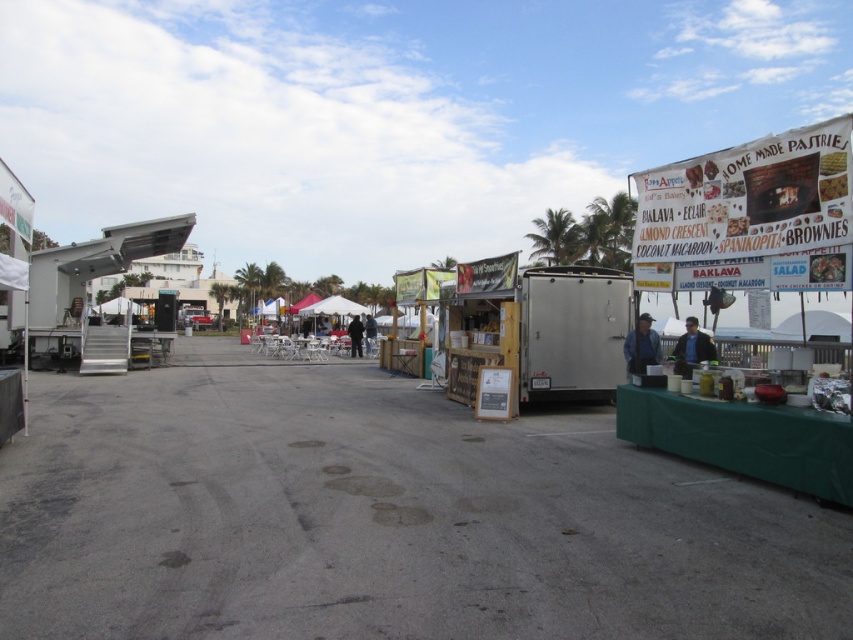
You are a customer at the outdoor market and want to buy a pastry. You see the blue fabric vendor at right and the white fabric canopy at center. Which vendor has a wider space for customers to stand around it?

The white fabric canopy at center has a greater width compared to the blue fabric vendor at right, so it provides a wider space for customers to stand around it.

You are a customer at the market and want to visit both points. If you start at point A, which is point (602, 278), and then move to point B, which is point (643, 337), will you be moving forward or backward relative to your starting position?

Moving from point A to point B, since point A is behind point B, you will be moving forward towards point B.